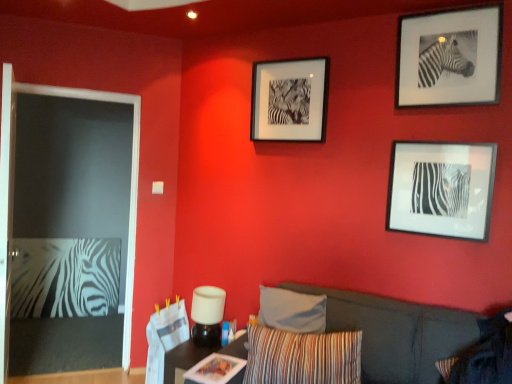
Where is `free space above black matte picture frame at center-right, acting as the 2th picture frame starting from the left (from a real-world perspective)`? The image size is (512, 384). free space above black matte picture frame at center-right, acting as the 2th picture frame starting from the left (from a real-world perspective) is located at coordinates (446, 138).